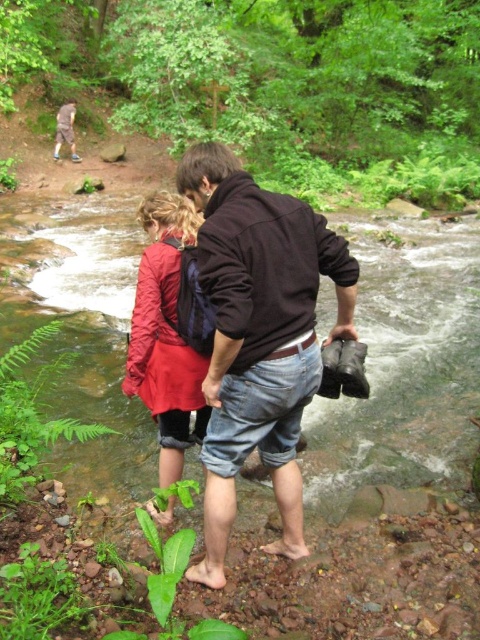
Between point (456, 380) and point (67, 106), which one is positioned in front?

Point (456, 380) is more forward.

Does clear water stream at center appear on the left side of brown leather jacket at upper left?

Incorrect, clear water stream at center is not on the left side of brown leather jacket at upper left.

Is point (256, 506) positioned after point (68, 125)?

No, it is not.

Where is `clear water stream at center`? The width and height of the screenshot is (480, 640). clear water stream at center is located at coordinates (404, 365).

Does green leafy forest at upper center have a greater height compared to matte red jacket at center?

Yes, green leafy forest at upper center is taller than matte red jacket at center.

Who is shorter, green leafy forest at upper center or matte red jacket at center?

matte red jacket at center is shorter.

What do you see at coordinates (274, 81) in the screenshot?
I see `green leafy forest at upper center` at bounding box center [274, 81].

Locate an element on the screen. green leafy forest at upper center is located at coordinates (274, 81).

Who is taller, green leafy forest at upper center or brown leather jacket at upper left?

With more height is green leafy forest at upper center.

Looking at this image, does green leafy forest at upper center have a larger size compared to brown leather jacket at upper left?

Yes.

Is point (61, 97) in front of point (60, 120)?

No, (61, 97) is behind (60, 120).

Find the location of `green leafy forest at upper center`. green leafy forest at upper center is located at coordinates (274, 81).